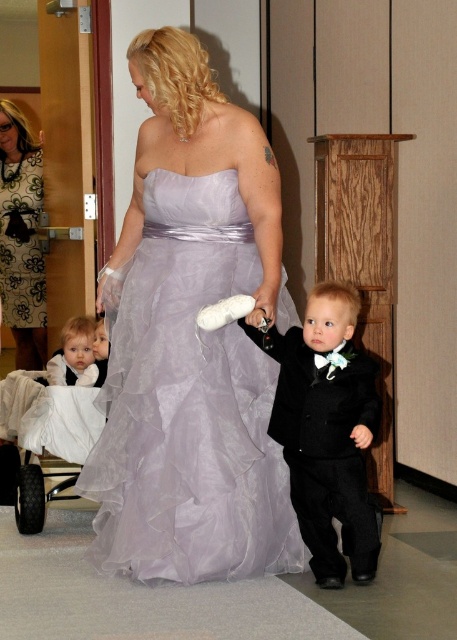
The image size is (457, 640). Describe the element at coordinates (187, 403) in the screenshot. I see `lavender tulle dress at center` at that location.

Is lavender tulle dress at center smaller than white satin dress at left?

Actually, lavender tulle dress at center might be larger than white satin dress at left.

Between point (212, 512) and point (69, 378), which one is positioned in front?

Point (212, 512) is more forward.

You are a GUI agent. You are given a task and a screenshot of the screen. Output one action in this format:
    pyautogui.click(x=<x>, y=<y>)
    Task: Click on the lavender tulle dress at center
    
    Given the screenshot: What is the action you would take?
    pyautogui.click(x=187, y=403)

Is lavender tulle dress at center shorter than black wool suit at center?

Incorrect, lavender tulle dress at center's height does not fall short of black wool suit at center's.

Measure the distance between lavender tulle dress at center and camera.

lavender tulle dress at center is 3.46 meters from camera.

Is point (206, 547) farther from viewer compared to point (340, 374)?

Yes, point (206, 547) is farther from viewer.

Find the location of `lavender tulle dress at center`. lavender tulle dress at center is located at coordinates (187, 403).

From the picture: Does black wool suit at center have a greater width compared to black printed dress at upper left?

Indeed, black wool suit at center has a greater width compared to black printed dress at upper left.

Describe the element at coordinates (327, 429) in the screenshot. I see `black wool suit at center` at that location.

Identify the location of black wool suit at center. This screenshot has height=640, width=457. (327, 429).